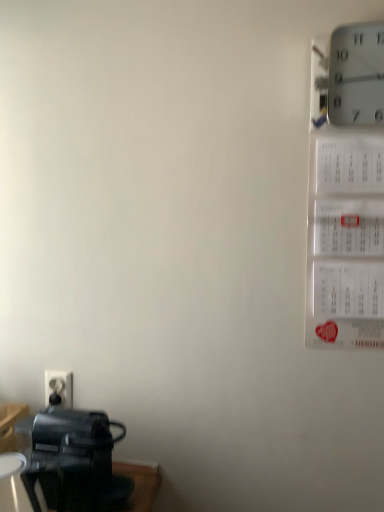
What is the approximate height of white plastic electric outlet at lower left?

It is 3.67 inches.

The width and height of the screenshot is (384, 512). I want to click on black plastic coffee maker at lower left, so (x=75, y=462).

Find the location of a particular element. Image resolution: width=384 pixels, height=512 pixels. white plastic electric outlet at lower left is located at coordinates (58, 388).

Is white plastic wall clock at upper right inside black plastic coffee maker at lower left?

No, white plastic wall clock at upper right is not inside black plastic coffee maker at lower left.

Which object is positioned more to the right, black plastic coffee maker at lower left or white plastic wall clock at upper right?

Positioned to the right is white plastic wall clock at upper right.

Is black plastic coffee maker at lower left positioned far away from white plastic wall clock at upper right?

Absolutely, black plastic coffee maker at lower left is distant from white plastic wall clock at upper right.

Measure the distance from black plastic coffee maker at lower left to white plastic wall clock at upper right.

A distance of 3.39 feet exists between black plastic coffee maker at lower left and white plastic wall clock at upper right.

Is white plastic wall clock at upper right not close to black plastic coffee maker at lower left?

Absolutely, white plastic wall clock at upper right is distant from black plastic coffee maker at lower left.

Considering the positions of point (346, 117) and point (37, 465), is point (346, 117) closer or farther from the camera than point (37, 465)?

Point (346, 117) appears to be farther away from the viewer than point (37, 465).

Locate an element on the screen. The image size is (384, 512). appliance on the left of white plastic wall clock at upper right is located at coordinates (75, 462).

Considering the sizes of objects black plastic coffee maker at lower left and white plastic electric outlet at lower left in the image provided, who is wider, black plastic coffee maker at lower left or white plastic electric outlet at lower left?

black plastic coffee maker at lower left is wider.

Image resolution: width=384 pixels, height=512 pixels. Identify the location of electric outlet behind the black plastic coffee maker at lower left. (58, 388).

From the picture: From the image's perspective, is black plastic coffee maker at lower left located above or below white plastic electric outlet at lower left?

Clearly, from the image's perspective, black plastic coffee maker at lower left is below white plastic electric outlet at lower left.

From the picture: Is black plastic coffee maker at lower left next to white plastic electric outlet at lower left?

No, black plastic coffee maker at lower left is not with white plastic electric outlet at lower left.

Is white plastic electric outlet at lower left aimed at white plastic wall clock at upper right?

No, white plastic electric outlet at lower left is not oriented towards white plastic wall clock at upper right.

Can you confirm if white plastic electric outlet at lower left is positioned to the left of white plastic wall clock at upper right?

Yes.

From a real-world perspective, is white plastic electric outlet at lower left under white plastic wall clock at upper right?

Correct, in the physical world, white plastic electric outlet at lower left is lower than white plastic wall clock at upper right.

This screenshot has height=512, width=384. Find the location of `electric outlet above the black plastic coffee maker at lower left (from a real-world perspective)`. electric outlet above the black plastic coffee maker at lower left (from a real-world perspective) is located at coordinates (58, 388).

From the image's perspective, does white plastic electric outlet at lower left appear higher than black plastic coffee maker at lower left?

Yes, from the image's perspective, white plastic electric outlet at lower left is above black plastic coffee maker at lower left.

Considering the relative positions of white plastic electric outlet at lower left and black plastic coffee maker at lower left in the image provided, is white plastic electric outlet at lower left to the right of black plastic coffee maker at lower left from the viewer's perspective?

In fact, white plastic electric outlet at lower left is to the left of black plastic coffee maker at lower left.

Is white plastic electric outlet at lower left inside the boundaries of black plastic coffee maker at lower left, or outside?

white plastic electric outlet at lower left is outside black plastic coffee maker at lower left.

Is white plastic wall clock at upper right far away from white plastic electric outlet at lower left?

Yes, white plastic wall clock at upper right is far from white plastic electric outlet at lower left.

Considering the sizes of objects white plastic wall clock at upper right and white plastic electric outlet at lower left in the image provided, who is bigger, white plastic wall clock at upper right or white plastic electric outlet at lower left?

white plastic wall clock at upper right is bigger.

Which is nearer, (359, 103) or (65, 381)?

Point (359, 103) is closer to the camera than point (65, 381).

From the picture: Who is more distant, white plastic wall clock at upper right or white plastic electric outlet at lower left?

white plastic electric outlet at lower left.

Where is `wall clock lying in front of the black plastic coffee maker at lower left`? wall clock lying in front of the black plastic coffee maker at lower left is located at coordinates (356, 75).

Find the location of a particular element. The height and width of the screenshot is (512, 384). appliance located underneath the white plastic wall clock at upper right (from a real-world perspective) is located at coordinates (75, 462).

Considering their positions, is white plastic electric outlet at lower left positioned further to black plastic coffee maker at lower left than white plastic wall clock at upper right?

white plastic wall clock at upper right is further to black plastic coffee maker at lower left.

Looking at the image, which one is located closer to black plastic coffee maker at lower left, white plastic wall clock at upper right or white plastic electric outlet at lower left?

white plastic electric outlet at lower left lies closer to black plastic coffee maker at lower left than the other object.

Based on their spatial positions, is black plastic coffee maker at lower left or white plastic wall clock at upper right further from white plastic electric outlet at lower left?

white plastic wall clock at upper right lies further to white plastic electric outlet at lower left than the other object.

Which object lies further to the anchor point white plastic electric outlet at lower left, white plastic wall clock at upper right or black plastic coffee maker at lower left?

white plastic wall clock at upper right is positioned further to the anchor white plastic electric outlet at lower left.

From the image, which object appears to be farther from white plastic wall clock at upper right, white plastic electric outlet at lower left or black plastic coffee maker at lower left?

The object further to white plastic wall clock at upper right is white plastic electric outlet at lower left.

Consider the image. When comparing their distances from white plastic wall clock at upper right, does black plastic coffee maker at lower left or white plastic electric outlet at lower left seem further?

white plastic electric outlet at lower left.

Locate an element on the screen. electric outlet between white plastic wall clock at upper right and black plastic coffee maker at lower left in the vertical direction is located at coordinates (58, 388).